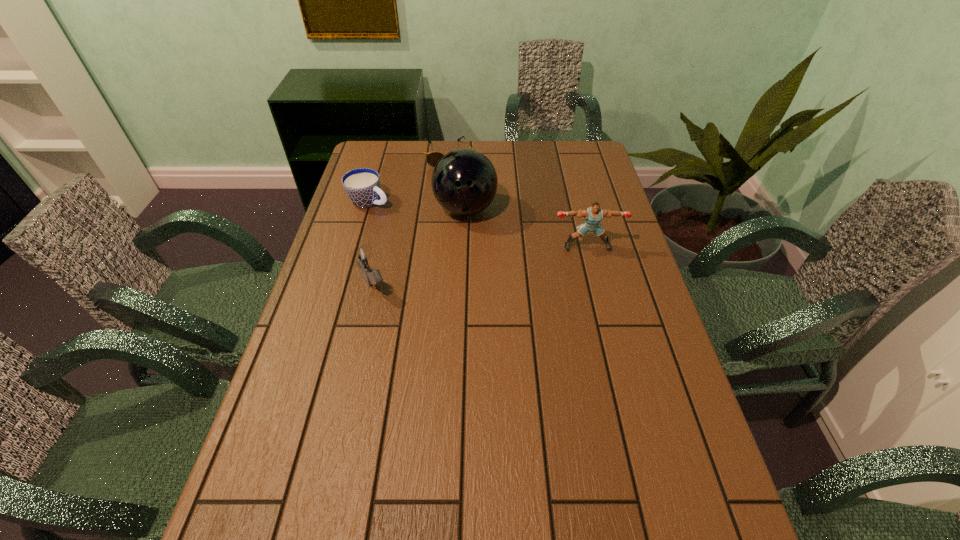
What are the coordinates of `vacant space on the desktop that is between the third tallest object and the rightmost object and is positioned on the side of the second shortest object with the handle` in the screenshot? It's located at (516, 260).

Where is `vacant spot on the desktop that is between the third shortest object and the puncher and is positioned on the lenses of the farthest object`? The width and height of the screenshot is (960, 540). vacant spot on the desktop that is between the third shortest object and the puncher and is positioned on the lenses of the farthest object is located at coordinates (468, 268).

I want to click on vacant spot on the desktop that is between the third shortest object and the rightmost object and is positioned on the side of the tallest object with the finger holes, so click(x=481, y=266).